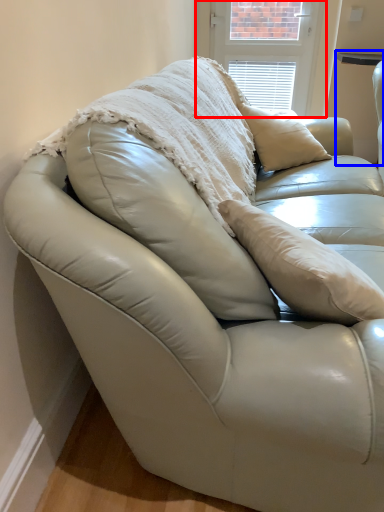
Question: Which object appears closest to the camera in this image, window screen (highlighted by a red box) or table (highlighted by a blue box)?

Choices:
 (A) window screen
 (B) table

Answer: (B)